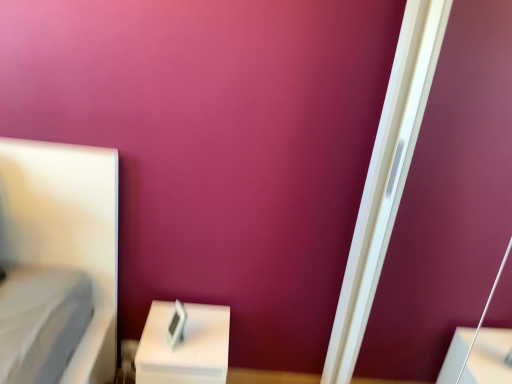
I want to click on empty space that is ontop of white plastic clock at lower center (from a real-world perspective), so click(196, 336).